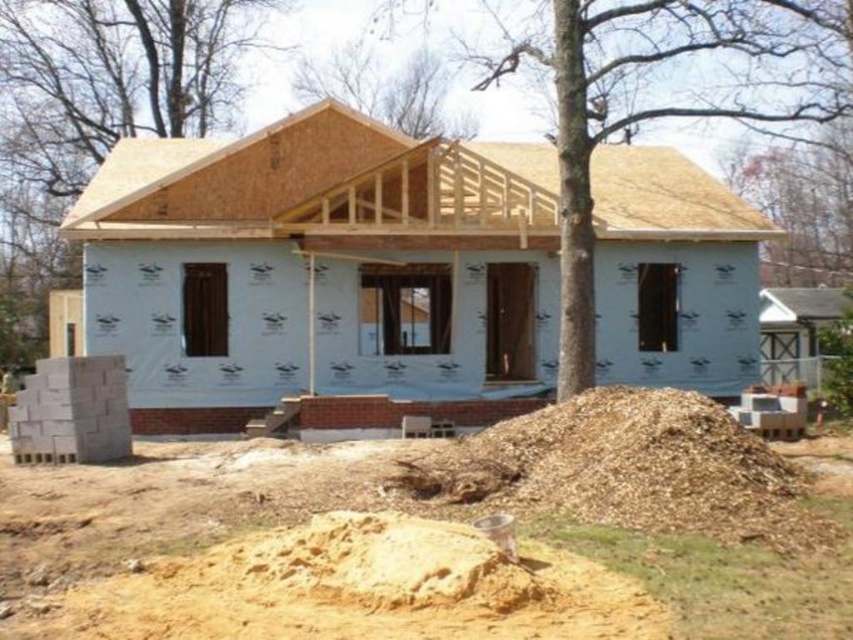
Question: Which of the following is the farthest from the observer?

Choices:
 (A) (254, 168)
 (B) (476, 461)

Answer: (A)

Question: Does light brown wood at upper center have a greater width compared to brown mulch at lower center?

Choices:
 (A) no
 (B) yes

Answer: (B)

Question: Does light brown wood at upper center appear on the right side of brown mulch at lower center?

Choices:
 (A) no
 (B) yes

Answer: (B)

Question: Which point is farther to the camera?

Choices:
 (A) light brown wood at upper center
 (B) brown mulch at lower center

Answer: (A)

Question: Is light brown wood at upper center smaller than brown mulch at lower center?

Choices:
 (A) no
 (B) yes

Answer: (A)

Question: Which point is closer to the camera taking this photo?

Choices:
 (A) (602, 464)
 (B) (337, 156)

Answer: (A)